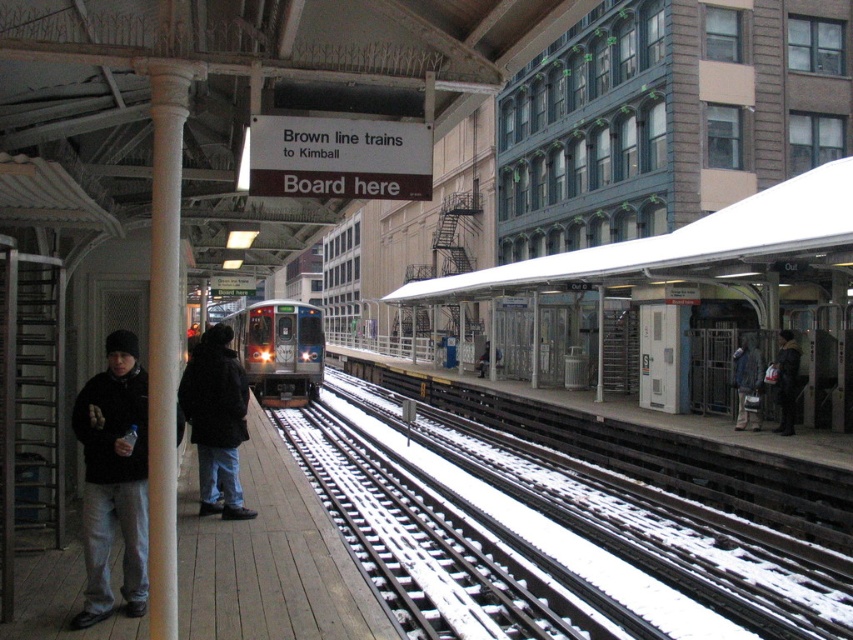
Question: Can you confirm if dark blue jacket at left is smaller than dark brown leather jacket at right?

Choices:
 (A) no
 (B) yes

Answer: (A)

Question: Among these points, which one is nearest to the camera?

Choices:
 (A) (242, 483)
 (B) (560, 476)
 (C) (753, 348)

Answer: (A)

Question: Does snow-covered metal tracks at center appear over dark brown leather jacket at right?

Choices:
 (A) yes
 (B) no

Answer: (B)

Question: Which point is closer to the camera?

Choices:
 (A) dark brown leather jacket at right
 (B) dark blue jacket at left
 (C) silver metallic train at center

Answer: (B)

Question: Can you confirm if dark blue jacket at left is bigger than gray fabric jacket at right?

Choices:
 (A) yes
 (B) no

Answer: (A)

Question: Which object is the farthest from the dark brown leather jacket at right?

Choices:
 (A) snow-covered metal tracks at center
 (B) white matte canopy at upper center

Answer: (B)